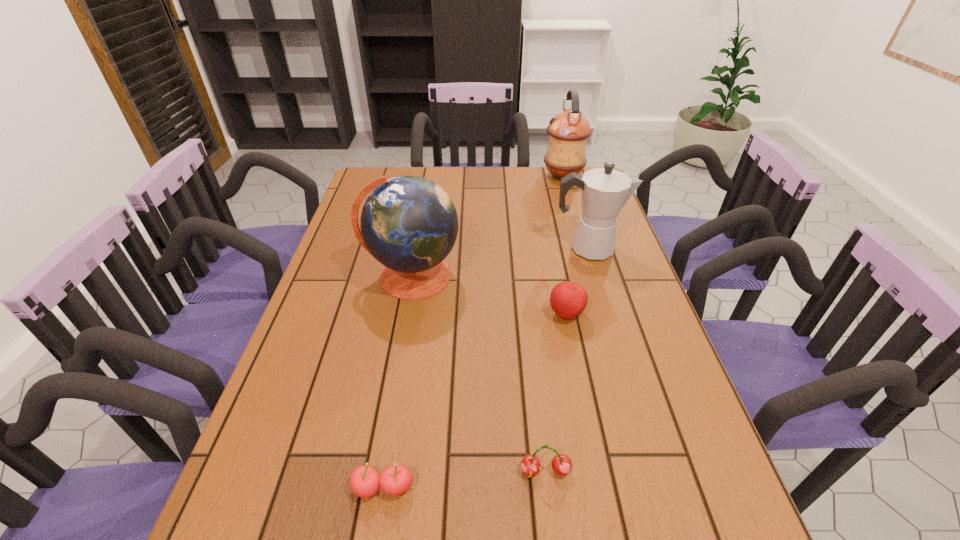
You are a GUI agent. You are given a task and a screenshot of the screen. Output one action in this format:
    pyautogui.click(x=<x>, y=<y>)
    Task: Click on the vacant area at the far left corner of the desktop
    This screenshot has width=960, height=540.
    Given the screenshot: What is the action you would take?
    pos(389,173)

Where is `free spot at the far right corner of the desktop`? The image size is (960, 540). free spot at the far right corner of the desktop is located at coordinates pyautogui.click(x=577, y=192).

Identify the location of free space between the apple and the farthest object. (564, 245).

Identify the location of empty space between the fourth object from right to left and the left cherry. (464, 480).

Image resolution: width=960 pixels, height=540 pixels. Identify the location of blank region between the apple and the globe. (489, 295).

You are a GUI agent. You are given a task and a screenshot of the screen. Output one action in this format:
    pyautogui.click(x=<x>, y=<y>)
    Task: Click on the free space that is in between the apple and the globe
    The width and height of the screenshot is (960, 540).
    Given the screenshot: What is the action you would take?
    pyautogui.click(x=489, y=295)

Identify the location of empty space that is in between the oil lamp and the coffeepot. (576, 212).

Locate an element on the screen. free spot between the globe and the farthest object is located at coordinates (488, 226).

The width and height of the screenshot is (960, 540). I want to click on vacant area between the coffeepot and the apple, so click(577, 281).

This screenshot has height=540, width=960. In order to click on free space between the apple and the globe in this screenshot , I will do `click(489, 295)`.